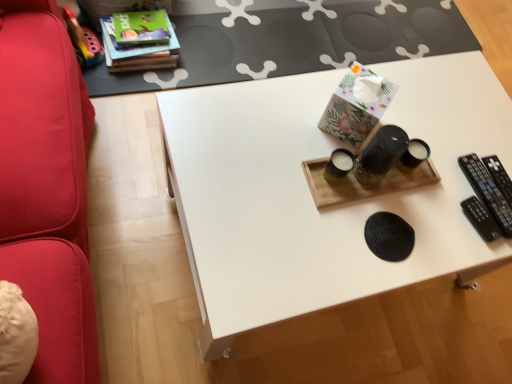
Describe the element at coordinates (310, 192) in the screenshot. I see `white matte tray at center` at that location.

Locate an element on the screen. The width and height of the screenshot is (512, 384). white matte table at upper center is located at coordinates (294, 41).

Is white matte table at upper center not close to hardcover book at upper left?

That's not correct — white matte table at upper center is a little close to hardcover book at upper left.

What's the angular difference between white matte table at upper center and hardcover book at upper left's facing directions?

The angular difference between white matte table at upper center and hardcover book at upper left is 1.74 degrees.

Is point (205, 7) closer to viewer compared to point (141, 57)?

That is False.

Find the location of a particular element. The height and width of the screenshot is (384, 512). table above the hardcover book at upper left (from the image's perspective) is located at coordinates (294, 41).

Considering the positions of objects hardcover book at upper left and black plastic remote at right in the image provided, who is more to the left, hardcover book at upper left or black plastic remote at right?

hardcover book at upper left.

Considering the sizes of objects hardcover book at upper left and black plastic remote at right in the image provided, who is smaller, hardcover book at upper left or black plastic remote at right?

black plastic remote at right.

Can you confirm if hardcover book at upper left is taller than black plastic remote at right?

Indeed, hardcover book at upper left has a greater height compared to black plastic remote at right.

Looking at this image, from a real-world perspective, does hardcover book at upper left sit lower than black plastic remote at right?

Yes, from a real-world perspective, hardcover book at upper left is under black plastic remote at right.

From a real-world perspective, is black plastic remote at right located higher than white matte table at upper center?

Indeed, from a real-world perspective, black plastic remote at right stands above white matte table at upper center.

Can you tell me how much black plastic remote at right and white matte table at upper center differ in facing direction?

93.5 degrees separate the facing orientations of black plastic remote at right and white matte table at upper center.

How much distance is there between black plastic remote at right and white matte table at upper center?

black plastic remote at right is 1.08 meters away from white matte table at upper center.

Identify the location of table above the black plastic remote at right (from the image's perspective). (294, 41).

From the picture: Can you tell me how much hardcover book at upper left and white matte tray at center differ in facing direction?

The angle between the facing direction of hardcover book at upper left and the facing direction of white matte tray at center is 2.7 degrees.

Considering the points (106, 24) and (326, 273), which point is in front, point (106, 24) or point (326, 273)?

Positioned in front is point (326, 273).

From a real-world perspective, is hardcover book at upper left below white matte tray at center?

Indeed, from a real-world perspective, hardcover book at upper left is positioned beneath white matte tray at center.

Is hardcover book at upper left oriented away from white matte tray at center?

That's not correct — hardcover book at upper left is not looking away from white matte tray at center.

Considering the sizes of objects white matte table at upper center and white matte tray at center in the image provided, who is wider, white matte table at upper center or white matte tray at center?

white matte table at upper center is wider.

Is white matte table at upper center inside or outside of white matte tray at center?

white matte table at upper center lies outside white matte tray at center.

Is white matte table at upper center positioned far away from white matte tray at center?

No.

Identify the location of desk on the left of black plastic remote at right. Image resolution: width=512 pixels, height=384 pixels. (310, 192).

From a real-world perspective, who is located higher, white matte tray at center or black plastic remote at right?

black plastic remote at right, from a real-world perspective.

Which is in front, white matte tray at center or black plastic remote at right?

white matte tray at center is in front.

From the image's perspective, does white matte tray at center appear lower than black plastic remote at right?

Yes, from the image's perspective, white matte tray at center is beneath black plastic remote at right.

In the image, is white matte tray at center positioned in front of or behind white matte table at upper center?

white matte tray at center is positioned closer to the viewer than white matte table at upper center.

Which of these two, white matte tray at center or white matte table at upper center, is wider?

Wider between the two is white matte table at upper center.

How many degrees apart are the facing directions of white matte tray at center and white matte table at upper center?

They differ by 0.961 degrees in their facing directions.

This screenshot has height=384, width=512. I want to click on book in front of the white matte table at upper center, so click(x=138, y=48).

Locate an element on the screen. This screenshot has width=512, height=384. control below the hardcover book at upper left (from the image's perspective) is located at coordinates click(x=487, y=192).

Considering their positions, is hardcover book at upper left positioned further to white matte tray at center than white matte table at upper center?

Based on the image, hardcover book at upper left appears to be further to white matte tray at center.

Which object lies nearer to the anchor point black plastic remote at right, hardcover book at upper left or white matte table at upper center?

white matte table at upper center is positioned closer to the anchor black plastic remote at right.

Estimate the real-world distances between objects in this image. Which object is closer to white matte tray at center, black plastic remote at right or hardcover book at upper left?

black plastic remote at right is closer to white matte tray at center.

Looking at this image, which object lies nearer to the anchor point white matte tray at center, white matte table at upper center or black plastic remote at right?

black plastic remote at right lies closer to white matte tray at center than the other object.

From the image, which object appears to be nearer to hardcover book at upper left, white matte table at upper center or white matte tray at center?

white matte table at upper center lies closer to hardcover book at upper left than the other object.

Considering their positions, is hardcover book at upper left positioned further to white matte tray at center than black plastic remote at right?

hardcover book at upper left is positioned further to the anchor white matte tray at center.

Considering their positions, is black plastic remote at right positioned further to hardcover book at upper left than white matte table at upper center?

Among the two, black plastic remote at right is located further to hardcover book at upper left.

From the image, which object appears to be nearer to white matte table at upper center, white matte tray at center or black plastic remote at right?

Among the two, white matte tray at center is located nearer to white matte table at upper center.

At what (x,y) coordinates should I click in order to perform the action: click on table situated between hardcover book at upper left and black plastic remote at right from left to right. Please return your answer as a coordinate pair (x, y). Image resolution: width=512 pixels, height=384 pixels. Looking at the image, I should click on (294, 41).

Where is `desk between hardcover book at upper left and black plastic remote at right from left to right`? desk between hardcover book at upper left and black plastic remote at right from left to right is located at coordinates (310, 192).

The height and width of the screenshot is (384, 512). I want to click on book between white matte tray at center and white matte table at upper center along the z-axis, so tap(138, 48).

Where is `control between white matte table at upper center and white matte tray at center vertically`? The height and width of the screenshot is (384, 512). control between white matte table at upper center and white matte tray at center vertically is located at coordinates (487, 192).